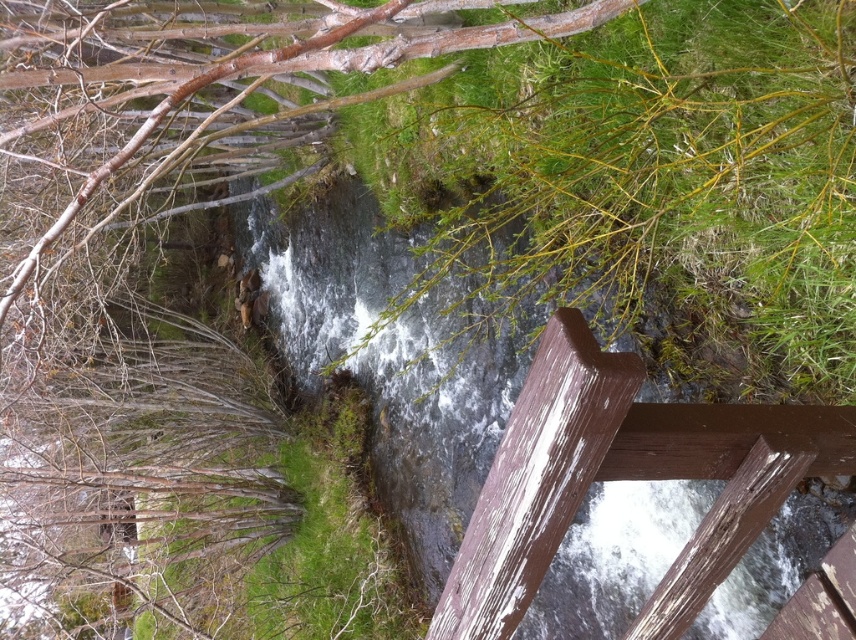
Is clear water at center thinner than smooth bark tree at upper left?

Correct, clear water at center's width is less than smooth bark tree at upper left's.

Which of these two, clear water at center or smooth bark tree at upper left, stands taller?

Standing taller between the two is clear water at center.

Is point (563, 573) in front of point (147, 90)?

No.

Where is `clear water at center`? The width and height of the screenshot is (856, 640). clear water at center is located at coordinates (437, 433).

Does white painted wood at center have a greater height compared to smooth bark tree at upper left?

No, white painted wood at center is not taller than smooth bark tree at upper left.

Does white painted wood at center have a lesser height compared to smooth bark tree at upper left?

Yes.

What do you see at coordinates (623, 480) in the screenshot?
I see `white painted wood at center` at bounding box center [623, 480].

Find the location of `white painted wood at center`. white painted wood at center is located at coordinates (623, 480).

Can you confirm if clear water at center is taller than white painted wood at center?

Indeed, clear water at center has a greater height compared to white painted wood at center.

From the picture: Which is more to the right, clear water at center or white painted wood at center?

white painted wood at center

Which is behind, point (722, 624) or point (550, 493)?

Positioned behind is point (722, 624).

In order to click on clear water at center in this screenshot , I will do `click(437, 433)`.